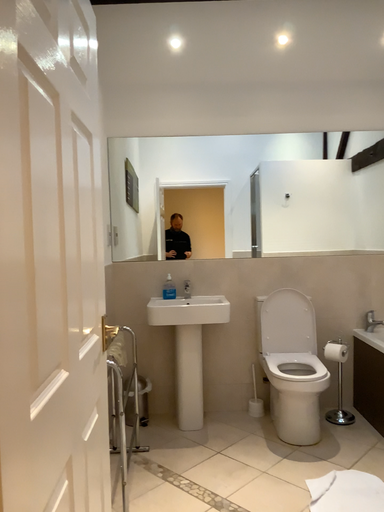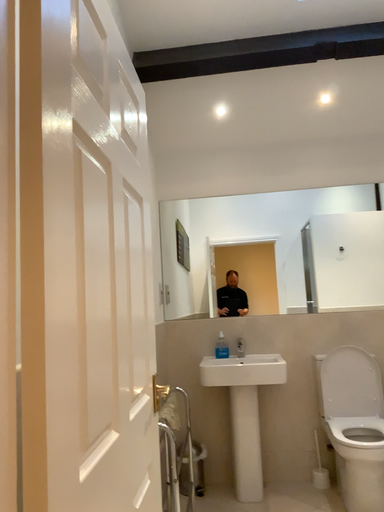
Question: How did the camera likely rotate when shooting the video?

Choices:
 (A) rotated downward
 (B) rotated upward

Answer: (B)